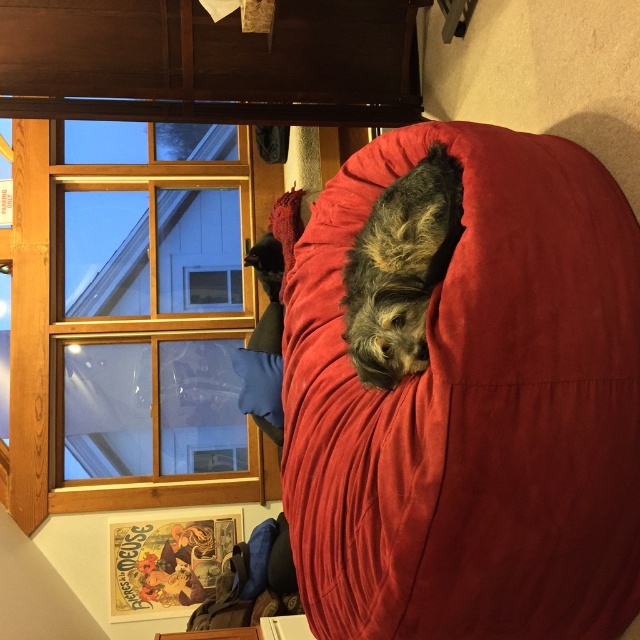
Question: Which is farther from the suede-like red bean bag at center?

Choices:
 (A) shaggy brown dog at center
 (B) wooden frame at upper left

Answer: (B)

Question: Which of the following is the farthest from the observer?

Choices:
 (A) shaggy brown dog at center
 (B) suede-like red bean bag at center

Answer: (A)

Question: Is wooden frame at upper left below shaggy brown dog at center?

Choices:
 (A) yes
 (B) no

Answer: (A)

Question: Which point appears farthest from the camera in this image?

Choices:
 (A) (509, 417)
 (B) (458, 221)

Answer: (B)

Question: Observing the image, what is the correct spatial positioning of wooden frame at upper left in reference to shaggy brown dog at center?

Choices:
 (A) right
 (B) left

Answer: (B)

Question: Does suede-like red bean bag at center come behind shaggy brown dog at center?

Choices:
 (A) yes
 (B) no

Answer: (B)